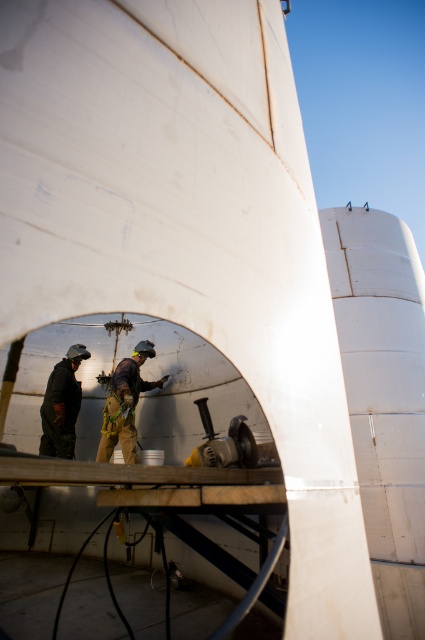
You are a safety inspector checking the workspace. You notice the camouflage fabric workwear at center and the metallic gray tool at center. Which item takes up more space in the area?

The camouflage fabric workwear at center is larger in size than the metallic gray tool at center, so it takes up more space in the area.